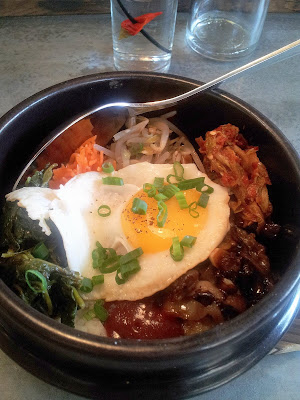
This screenshot has width=300, height=400. What are the coordinates of `black ceramic bowl` in the screenshot? It's located at (235, 354).